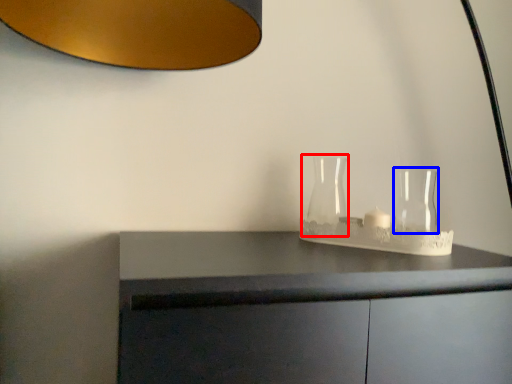
Question: Among these objects, which one is farthest to the camera, glass vase (highlighted by a red box) or glass vase (highlighted by a blue box)?

Choices:
 (A) glass vase
 (B) glass vase

Answer: (A)